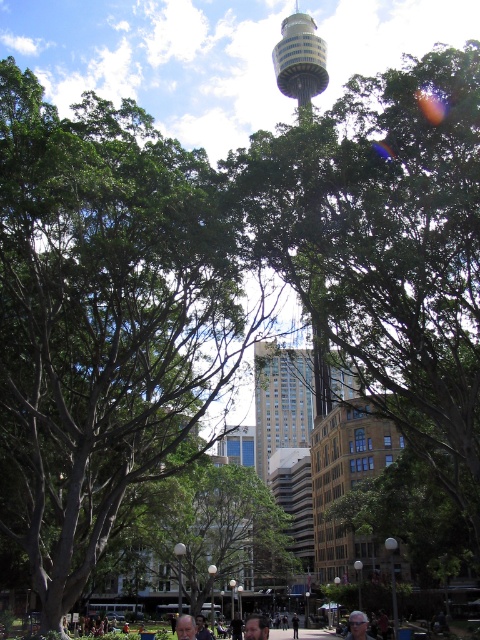
You are standing at the entrance of the park and want to reach the green leafy tree at center. According to the coordinates provided, what are the exact coordinates of the tree?

The green leafy tree at center is located at coordinates point [387,248].

You are a park visitor standing at the edge of the park. You see the green leafy tree at center and the brown leather jacket at center. Which object is higher from the ground?

The green leafy tree at center is positioned over the brown leather jacket at center, so the tree is higher from the ground than the jacket.